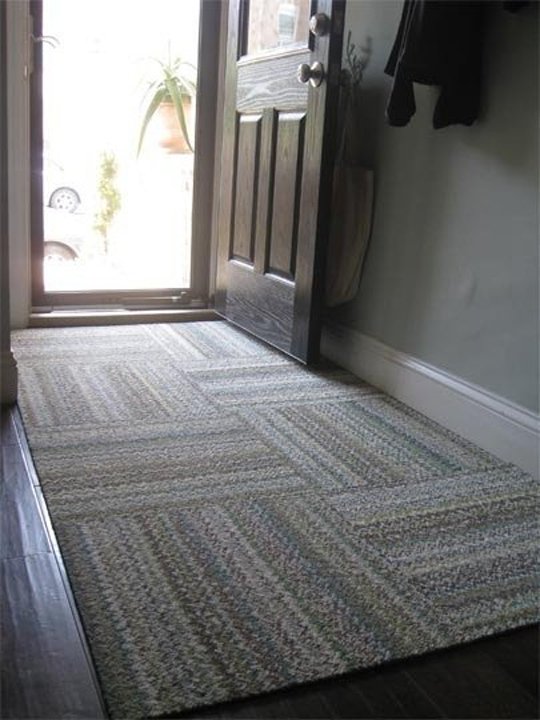
Image resolution: width=540 pixels, height=720 pixels. Identify the location of closest carpet square. (236, 611).